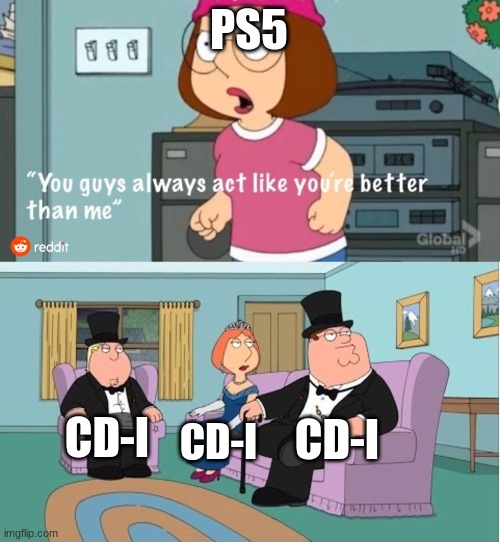
Where is `couch`? The height and width of the screenshot is (542, 500). couch is located at coordinates (391, 495).